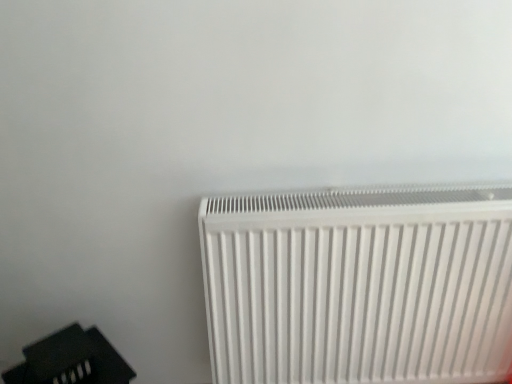
In order to face black plastic speaker at lower left, should I rotate leftwards or rightwards?

A 23.328 degree turn to the left will do.

The image size is (512, 384). Describe the element at coordinates (71, 360) in the screenshot. I see `black plastic speaker at lower left` at that location.

Where is `black plastic speaker at lower left`? black plastic speaker at lower left is located at coordinates (71, 360).

Locate an element on the screen. white plastic radiator at lower right is located at coordinates (359, 285).

What do you see at coordinates (359, 285) in the screenshot? The height and width of the screenshot is (384, 512). I see `white plastic radiator at lower right` at bounding box center [359, 285].

This screenshot has height=384, width=512. I want to click on black plastic speaker at lower left, so click(x=71, y=360).

From the picture: Which object is positioned more to the left, black plastic speaker at lower left or white plastic radiator at lower right?

black plastic speaker at lower left.

Considering the positions of objects black plastic speaker at lower left and white plastic radiator at lower right in the image provided, who is behind, black plastic speaker at lower left or white plastic radiator at lower right?

white plastic radiator at lower right is behind.

Does point (7, 383) appear closer or farther from the camera than point (500, 350)?

Point (7, 383) appears to be farther away from the viewer than point (500, 350).

Based on the photo, from the image's perspective, is black plastic speaker at lower left over white plastic radiator at lower right?

No, from the image's perspective, black plastic speaker at lower left is not on top of white plastic radiator at lower right.

From a real-world perspective, is black plastic speaker at lower left on white plastic radiator at lower right?

No.

Which object is wider, black plastic speaker at lower left or white plastic radiator at lower right?

Wider between the two is black plastic speaker at lower left.

In terms of height, does black plastic speaker at lower left look taller or shorter compared to white plastic radiator at lower right?

black plastic speaker at lower left is shorter than white plastic radiator at lower right.

In terms of size, does black plastic speaker at lower left appear bigger or smaller than white plastic radiator at lower right?

black plastic speaker at lower left is smaller than white plastic radiator at lower right.

Is black plastic speaker at lower left not inside white plastic radiator at lower right?

That's correct, black plastic speaker at lower left is outside of white plastic radiator at lower right.

Is black plastic speaker at lower left not close to white plastic radiator at lower right?

No, there isn't a large distance between black plastic speaker at lower left and white plastic radiator at lower right.

Is black plastic speaker at lower left facing away from white plastic radiator at lower right?

No, black plastic speaker at lower left's orientation is not away from white plastic radiator at lower right.

What's the angular difference between black plastic speaker at lower left and white plastic radiator at lower right's facing directions?

The angular difference between black plastic speaker at lower left and white plastic radiator at lower right is 41.4 degrees.

Based on the photo, measure the distance between black plastic speaker at lower left and white plastic radiator at lower right.

26.50 inches.

This screenshot has height=384, width=512. Identify the location of radiator that appears behind the black plastic speaker at lower left. (359, 285).

Which is more to the left, white plastic radiator at lower right or black plastic speaker at lower left?

From the viewer's perspective, black plastic speaker at lower left appears more on the left side.

Which object is further away from the camera taking this photo, white plastic radiator at lower right or black plastic speaker at lower left?

Positioned behind is white plastic radiator at lower right.

Considering the positions of points (298, 257) and (122, 378), is point (298, 257) farther from camera compared to point (122, 378)?

No, (298, 257) is in front of (122, 378).

From the image's perspective, between white plastic radiator at lower right and black plastic speaker at lower left, which one is located above?

From the image's view, white plastic radiator at lower right is above.

From a real-world perspective, which object rests below the other?

In real-world perspective, black plastic speaker at lower left is lower.

Considering the sizes of objects white plastic radiator at lower right and black plastic speaker at lower left in the image provided, who is thinner, white plastic radiator at lower right or black plastic speaker at lower left?

white plastic radiator at lower right.

From their relative heights in the image, would you say white plastic radiator at lower right is taller or shorter than black plastic speaker at lower left?

Clearly, white plastic radiator at lower right is taller compared to black plastic speaker at lower left.

Is white plastic radiator at lower right bigger than black plastic speaker at lower left?

Yes, white plastic radiator at lower right is bigger than black plastic speaker at lower left.

Is white plastic radiator at lower right positioned beyond the bounds of black plastic speaker at lower left?

That's correct, white plastic radiator at lower right is outside of black plastic speaker at lower left.

Would you consider white plastic radiator at lower right to be distant from black plastic speaker at lower left?

No, white plastic radiator at lower right is not far away from black plastic speaker at lower left.

Is white plastic radiator at lower right positioned with its back to black plastic speaker at lower left?

No, white plastic radiator at lower right is not facing the opposite direction of black plastic speaker at lower left.

Locate an element on the screen. radiator lying on the right of black plastic speaker at lower left is located at coordinates [359, 285].

The image size is (512, 384). Find the location of `radiator lying above the black plastic speaker at lower left (from the image's perspective)`. radiator lying above the black plastic speaker at lower left (from the image's perspective) is located at coordinates (359, 285).

This screenshot has width=512, height=384. In order to click on radiator behind the black plastic speaker at lower left in this screenshot , I will do `click(359, 285)`.